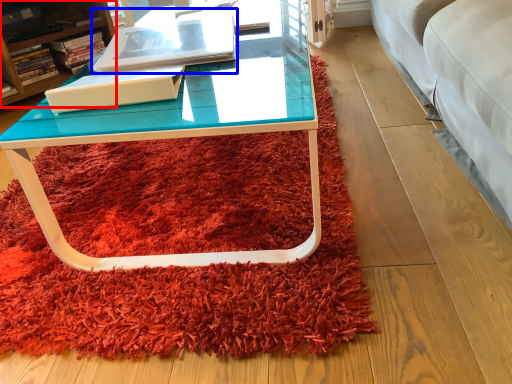
Question: Which point is further to the camera, cabinetry (highlighted by a red box) or book (highlighted by a blue box)?

Choices:
 (A) cabinetry
 (B) book

Answer: (A)